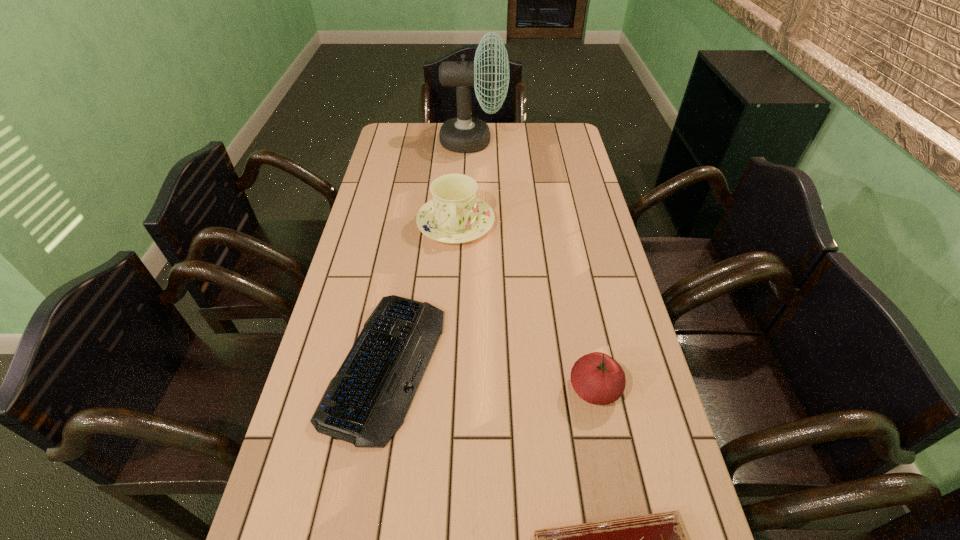
The width and height of the screenshot is (960, 540). I want to click on object that is at the far edge, so click(464, 134).

Where is `object present at the left edge`? object present at the left edge is located at coordinates (365, 403).

This screenshot has height=540, width=960. Find the location of `object at the right edge`. object at the right edge is located at coordinates (597, 378).

Identify the location of vacant region at the far edge of the desktop. (520, 148).

Locate an element on the screen. vacant space at the left edge is located at coordinates (409, 172).

In the image, there is a desktop. Where is `free region at the right edge`? Image resolution: width=960 pixels, height=540 pixels. free region at the right edge is located at coordinates (563, 166).

The width and height of the screenshot is (960, 540). I want to click on blank space at the far left corner of the desktop, so click(x=399, y=149).

This screenshot has height=540, width=960. In the image, there is a desktop. In order to click on blank space at the far right corner in this screenshot , I will do `click(552, 143)`.

At what (x,y) coordinates should I click in order to perform the action: click on free space between the computer keyboard and the chinaware. Please return your answer as a coordinate pair (x, y). The height and width of the screenshot is (540, 960). Looking at the image, I should click on (420, 294).

Where is `vacant space that is in between the computer keyboard and the chinaware`? vacant space that is in between the computer keyboard and the chinaware is located at coordinates (420, 294).